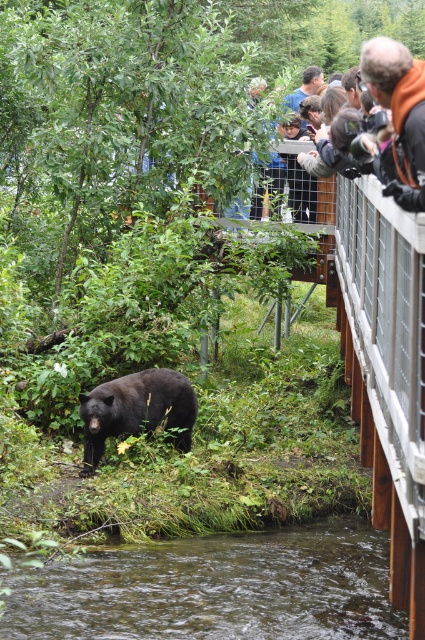
You are a park ranger guiding tourists near the wooden walkway. You see the black furry bear at lower left and the orange jacket at upper right. Which object is positioned lower in the image?

The black furry bear at lower left is positioned lower in the image than the orange jacket at upper right.

You are a tour guide leading a group near the wooden walkway. You notice the clear water at lower center and the orange jacket at upper right. Which object in the scene is larger?

The clear water at lower center is bigger than the orange jacket at upper right.

You are standing on the wooden walkway with a metal railing and want to take a photo of the black bear walking along the stream. There are two points marked on your camera screen at coordinates point (x=17, y=614) and point (x=82, y=472). Which point is closer to your camera lens?

Point (x=17, y=614) is closer to the camera lens than point (x=82, y=472).